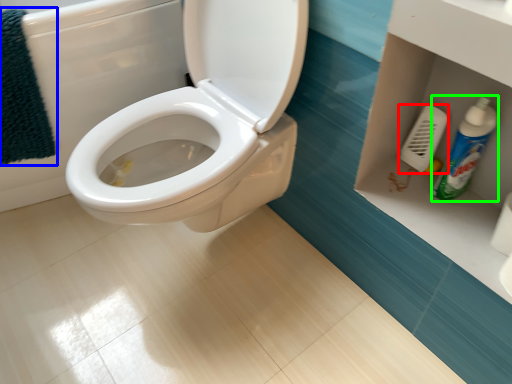
Question: Which is farther away from towel bar (highlighted by a red box)? bath towel (highlighted by a blue box) or cleaning product (highlighted by a green box)?

Choices:
 (A) bath towel
 (B) cleaning product

Answer: (A)